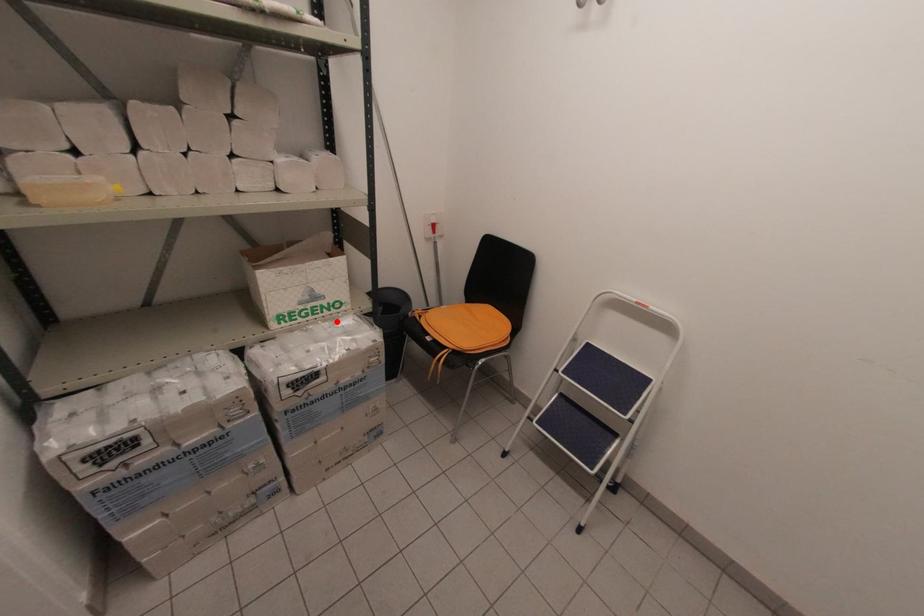
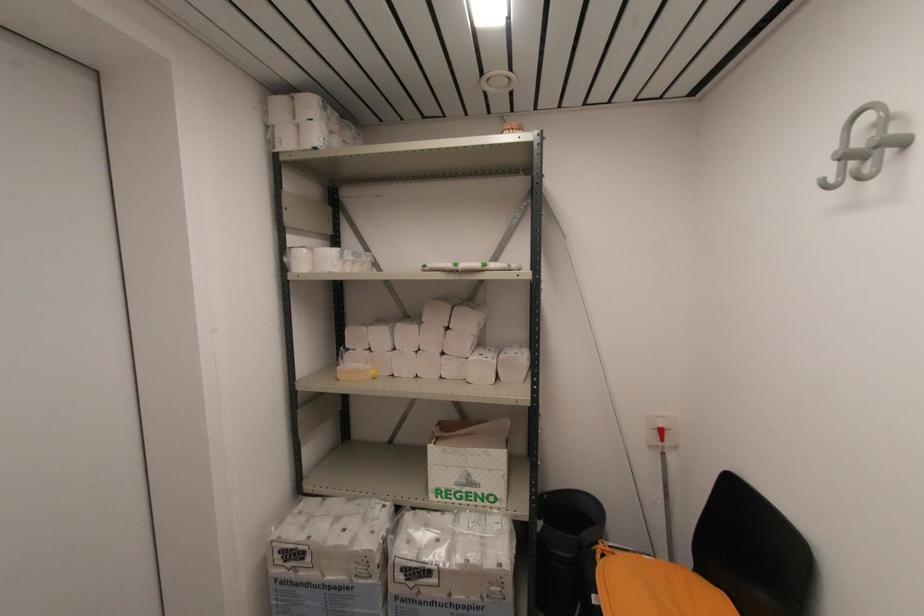
Where in the second image is the point corresponding to the highlighted location from the first image?

(484, 517)